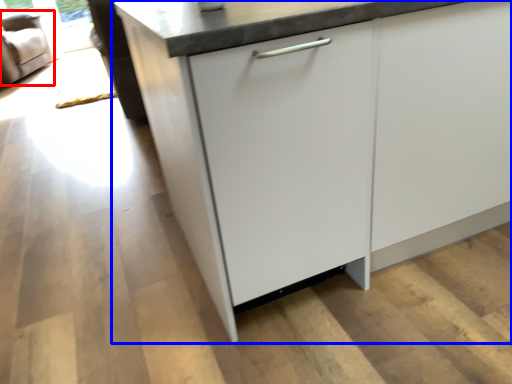
Question: Which object is further to the camera taking this photo, armchair (highlighted by a red box) or cabinetry (highlighted by a blue box)?

Choices:
 (A) armchair
 (B) cabinetry

Answer: (A)